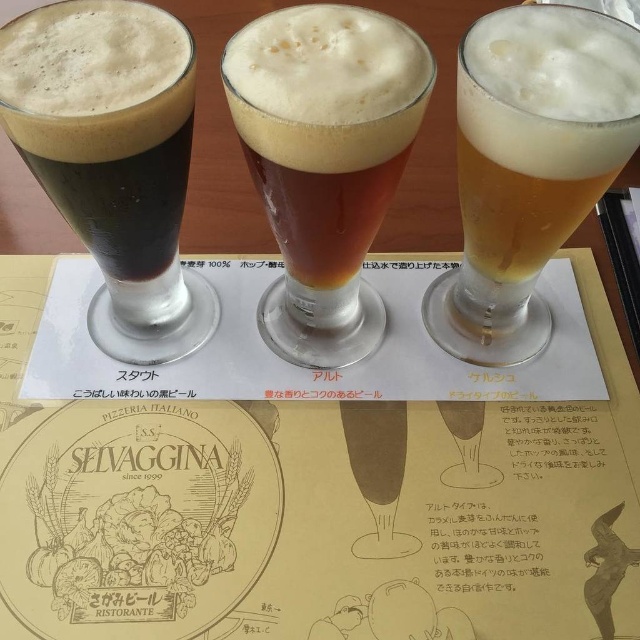
Does amber glass beer at center have a lesser width compared to golden frothy beer at right?

Incorrect, amber glass beer at center's width is not less than golden frothy beer at right's.

Between point (310, 321) and point (445, 340), which one is positioned behind?

Point (445, 340)

Where is `amber glass beer at center`? The image size is (640, 640). amber glass beer at center is located at coordinates (324, 163).

In order to click on matte paper menu at center in this screenshot , I will do `click(321, 508)`.

Is matte paper menu at center bigger than amber glass beer at center?

Yes, matte paper menu at center is bigger than amber glass beer at center.

Measure the distance between matte paper menu at center and camera.

The distance of matte paper menu at center from camera is 19.42 inches.

Image resolution: width=640 pixels, height=640 pixels. I want to click on matte paper menu at center, so click(321, 508).

Can you confirm if dark brown glass at left is positioned to the right of golden frothy beer at right?

No, dark brown glass at left is not to the right of golden frothy beer at right.

Does dark brown glass at left appear over golden frothy beer at right?

Indeed, dark brown glass at left is positioned over golden frothy beer at right.

Where is `dark brown glass at left`? The width and height of the screenshot is (640, 640). dark brown glass at left is located at coordinates (115, 160).